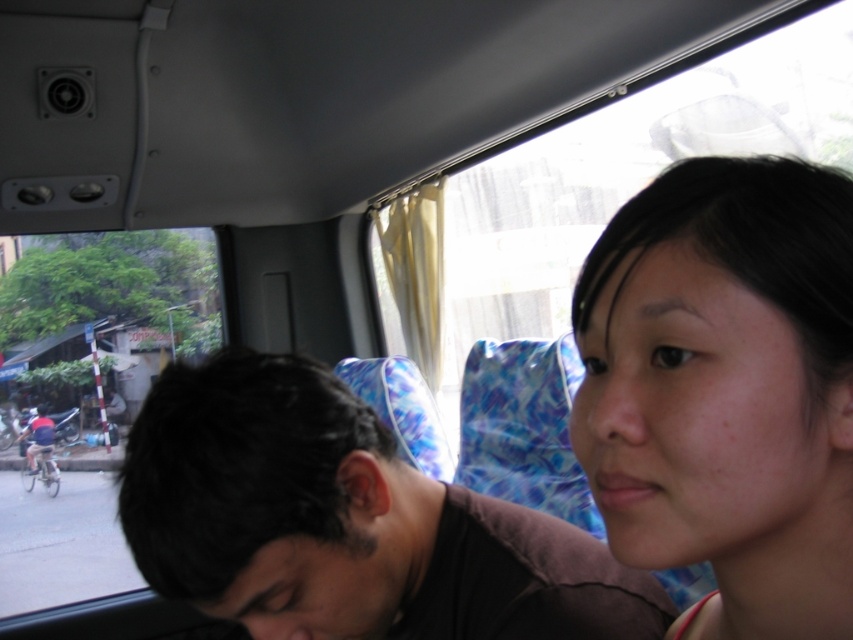
Question: Is the position of smooth skin face at center more distant than that of transparent glass window at left?

Choices:
 (A) yes
 (B) no

Answer: (B)

Question: Which point appears farthest from the camera in this image?

Choices:
 (A) (132, 330)
 (B) (358, 577)
 (C) (619, 275)

Answer: (A)

Question: Estimate the real-world distances between objects in this image. Which object is closer to the smooth skin face at center?

Choices:
 (A) transparent glass window at left
 (B) dark brown hair at center

Answer: (B)

Question: Is dark brown hair at center wider than transparent glass window at left?

Choices:
 (A) yes
 (B) no

Answer: (B)

Question: In this image, where is dark brown hair at center located relative to transparent glass window at left?

Choices:
 (A) left
 (B) right

Answer: (B)

Question: Which point is farther to the camera?

Choices:
 (A) dark brown hair at center
 (B) transparent glass window at left
 (C) smooth skin face at center

Answer: (B)